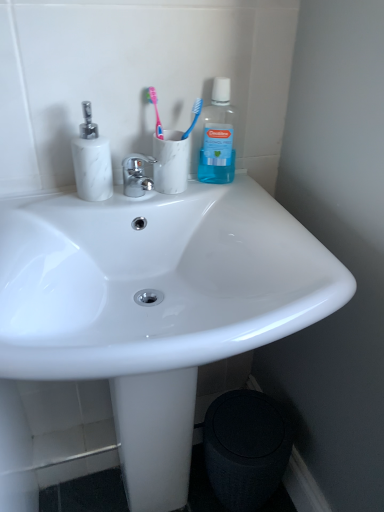
Measure the distance between point (232, 146) and camera.

37.72 inches.

From the picture: Measure the distance between point (179, 185) and camera.

Point (179, 185) and camera are 86.30 centimeters apart.

The height and width of the screenshot is (512, 384). What do you see at coordinates (139, 324) in the screenshot?
I see `white glossy sink at center` at bounding box center [139, 324].

What do you see at coordinates (136, 175) in the screenshot? Image resolution: width=384 pixels, height=512 pixels. I see `chrome/metallic faucet at center` at bounding box center [136, 175].

The image size is (384, 512). Identify the location of pink plastic toothbrush at upper center, which is the 1th toothbrush in left-to-right order. (155, 111).

What do you see at coordinates (155, 111) in the screenshot? I see `pink plastic toothbrush at upper center, the 2th toothbrush viewed from the right` at bounding box center [155, 111].

The width and height of the screenshot is (384, 512). I want to click on transparent plastic mouthwash at upper right, so click(x=217, y=136).

Which of these two, chrome/metallic faucet at center or pink plastic toothbrush at upper center, which is the 1th toothbrush in left-to-right order, is bigger?

chrome/metallic faucet at center.

Does chrome/metallic faucet at center have a greater height compared to pink plastic toothbrush at upper center, which is the 1th toothbrush in left-to-right order?

In fact, chrome/metallic faucet at center may be shorter than pink plastic toothbrush at upper center, which is the 1th toothbrush in left-to-right order.

Could pink plastic toothbrush at upper center, the 2th toothbrush viewed from the right, be considered to be inside chrome/metallic faucet at center?

No, pink plastic toothbrush at upper center, the 2th toothbrush viewed from the right, is not inside chrome/metallic faucet at center.

Is chrome/metallic faucet at center at the left side of pink plastic toothbrush at upper center, the 2th toothbrush viewed from the right?

Correct, you'll find chrome/metallic faucet at center to the left of pink plastic toothbrush at upper center, the 2th toothbrush viewed from the right.

In the scene shown: Can you confirm if black textured trash bin/can at lower right is smaller than white marble toothbrush holder at upper center?

Actually, black textured trash bin/can at lower right might be larger than white marble toothbrush holder at upper center.

From the image's perspective, is black textured trash bin/can at lower right positioned above or below white marble toothbrush holder at upper center?

Clearly, from the image's perspective, black textured trash bin/can at lower right is below white marble toothbrush holder at upper center.

Considering the relative sizes of black textured trash bin/can at lower right and white marble toothbrush holder at upper center in the image provided, is black textured trash bin/can at lower right thinner than white marble toothbrush holder at upper center?

No, black textured trash bin/can at lower right is not thinner than white marble toothbrush holder at upper center.

In the scene shown: From the image's perspective, which one is positioned higher, transparent plastic mouthwash at upper right or white glossy sink at center?

transparent plastic mouthwash at upper right, from the image's perspective.

Which point is more distant from viewer, (225, 166) or (118, 413)?

Point (225, 166)

From their relative heights in the image, would you say transparent plastic mouthwash at upper right is taller or shorter than white glossy sink at center?

Clearly, transparent plastic mouthwash at upper right is shorter compared to white glossy sink at center.

Considering their positions, is pink plastic toothbrush at upper center, the 2th toothbrush viewed from the right, located in front of or behind chrome/metallic faucet at center?

pink plastic toothbrush at upper center, the 2th toothbrush viewed from the right, is positioned farther from the viewer than chrome/metallic faucet at center.

Considering the sizes of pink plastic toothbrush at upper center, which is the 1th toothbrush in left-to-right order, and chrome/metallic faucet at center in the image, is pink plastic toothbrush at upper center, which is the 1th toothbrush in left-to-right order, taller or shorter than chrome/metallic faucet at center?

pink plastic toothbrush at upper center, which is the 1th toothbrush in left-to-right order, is taller than chrome/metallic faucet at center.

From the picture: Does pink plastic toothbrush at upper center, which is the 1th toothbrush in left-to-right order, turn towards chrome/metallic faucet at center?

No, pink plastic toothbrush at upper center, which is the 1th toothbrush in left-to-right order, does not turn towards chrome/metallic faucet at center.

Is pink plastic toothbrush at upper center, the 2th toothbrush viewed from the right, far from chrome/metallic faucet at center?

pink plastic toothbrush at upper center, the 2th toothbrush viewed from the right, is near chrome/metallic faucet at center, not far away.

Which object is closer to the camera, blue translucent toothbrush at upper center, marked as the second toothbrush in a left-to-right arrangement, or white glossy sink at center?

Positioned in front is white glossy sink at center.

Is blue translucent toothbrush at upper center, marked as the second toothbrush in a left-to-right arrangement, positioned far away from white glossy sink at center?

No.

Measure the distance between blue translucent toothbrush at upper center, the 1th toothbrush from the right, and white glossy sink at center.

blue translucent toothbrush at upper center, the 1th toothbrush from the right, and white glossy sink at center are 21.16 inches apart.

Is blue translucent toothbrush at upper center, the 1th toothbrush from the right, turned away from white glossy sink at center?

That's not correct — blue translucent toothbrush at upper center, the 1th toothbrush from the right, is not looking away from white glossy sink at center.

Is black textured trash bin/can at lower right facing towards chrome/metallic faucet at center?

No, black textured trash bin/can at lower right is not facing towards chrome/metallic faucet at center.

Relative to chrome/metallic faucet at center, is black textured trash bin/can at lower right in front or behind?

Visually, black textured trash bin/can at lower right is located behind chrome/metallic faucet at center.

Is black textured trash bin/can at lower right bigger or smaller than chrome/metallic faucet at center?

In the image, black textured trash bin/can at lower right appears to be larger than chrome/metallic faucet at center.

Is black textured trash bin/can at lower right not inside chrome/metallic faucet at center?

black textured trash bin/can at lower right lies outside chrome/metallic faucet at center's area.

From a real-world perspective, is black textured trash bin/can at lower right physically below transparent plastic mouthwash at upper right?

Indeed, from a real-world perspective, black textured trash bin/can at lower right is positioned beneath transparent plastic mouthwash at upper right.

Is black textured trash bin/can at lower right positioned with its back to transparent plastic mouthwash at upper right?

black textured trash bin/can at lower right is not turned away from transparent plastic mouthwash at upper right.

From the image's perspective, which one is positioned lower, black textured trash bin/can at lower right or transparent plastic mouthwash at upper right?

black textured trash bin/can at lower right.

Is transparent plastic mouthwash at upper right a part of black textured trash bin/can at lower right?

Actually, transparent plastic mouthwash at upper right is outside black textured trash bin/can at lower right.

From the image's perspective, count 2nd toothbrushs upward from the chrome/metallic faucet at center and point to it. Please provide its 2D coordinates.

[(155, 111)]

Locate an element on the screen. Image resolution: width=384 pixels, height=512 pixels. trash bin/can behind the white marble toothbrush holder at upper center is located at coordinates (245, 448).

When comparing their distances from white marble toothbrush holder at upper center, does chrome/metallic faucet at center or pink plastic toothbrush at upper center, the 2th toothbrush viewed from the right, seem further?

The object further to white marble toothbrush holder at upper center is pink plastic toothbrush at upper center, the 2th toothbrush viewed from the right.

Which object lies nearer to the anchor point black textured trash bin/can at lower right, transparent plastic mouthwash at upper right or pink plastic toothbrush at upper center, which is the 1th toothbrush in left-to-right order?

transparent plastic mouthwash at upper right is positioned closer to the anchor black textured trash bin/can at lower right.

Considering their positions, is black textured trash bin/can at lower right positioned closer to white marble toothbrush holder at upper center than pink plastic toothbrush at upper center, which is the 1th toothbrush in left-to-right order?

pink plastic toothbrush at upper center, which is the 1th toothbrush in left-to-right order, lies closer to white marble toothbrush holder at upper center than the other object.

When comparing their distances from black textured trash bin/can at lower right, does white marble toothbrush holder at upper center or transparent plastic mouthwash at upper right seem closer?

The object closer to black textured trash bin/can at lower right is white marble toothbrush holder at upper center.

Considering their positions, is pink plastic toothbrush at upper center, which is the 1th toothbrush in left-to-right order, positioned further to white glossy sink at center than white marble soap dispenser at left?

pink plastic toothbrush at upper center, which is the 1th toothbrush in left-to-right order.

From the image, which object appears to be farther from white marble soap dispenser at left, blue translucent toothbrush at upper center, the 1th toothbrush from the right, or pink plastic toothbrush at upper center, the 2th toothbrush viewed from the right?

Among the two, blue translucent toothbrush at upper center, the 1th toothbrush from the right, is located further to white marble soap dispenser at left.

Looking at the image, which one is located closer to chrome/metallic faucet at center, white marble toothbrush holder at upper center or transparent plastic mouthwash at upper right?

Based on the image, white marble toothbrush holder at upper center appears to be nearer to chrome/metallic faucet at center.

When comparing their distances from white marble toothbrush holder at upper center, does pink plastic toothbrush at upper center, the 2th toothbrush viewed from the right, or chrome/metallic faucet at center seem closer?

Based on the image, chrome/metallic faucet at center appears to be nearer to white marble toothbrush holder at upper center.

This screenshot has height=512, width=384. I want to click on coffee cup between white marble soap dispenser at left and transparent plastic mouthwash at upper right from left to right, so click(171, 162).

In order to click on faucet between transparent plastic mouthwash at upper right and white glossy sink at center vertically in this screenshot , I will do `click(136, 175)`.

In order to click on sink between blue translucent toothbrush at upper center, the 1th toothbrush from the right, and black textured trash bin/can at lower right vertically in this screenshot , I will do click(x=139, y=324).

Find the location of a particular element. sink between transparent plastic mouthwash at upper right and black textured trash bin/can at lower right in the up-down direction is located at coordinates (139, 324).